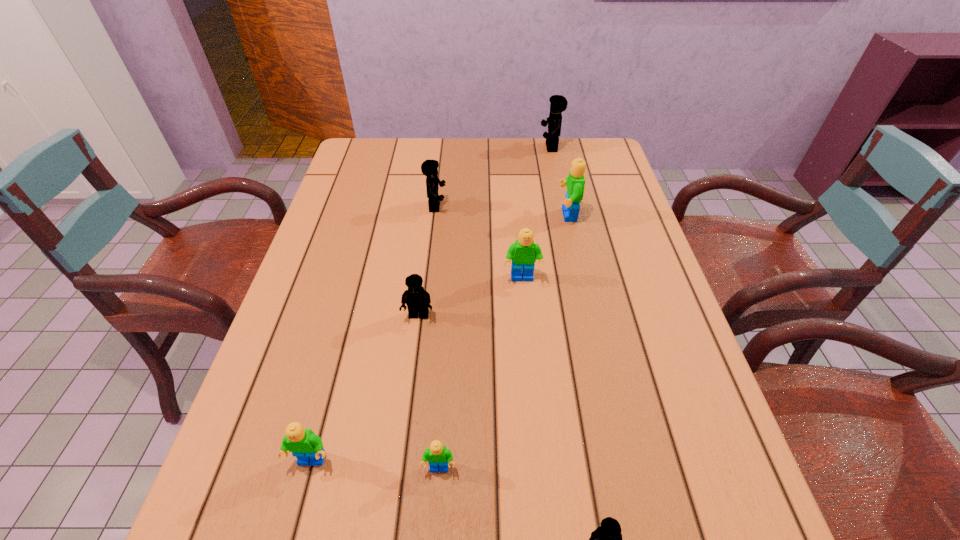
I want to click on blank space at the near left corner of the desktop, so click(x=243, y=521).

The width and height of the screenshot is (960, 540). Find the location of `vacant space at the far right corner of the desktop`. vacant space at the far right corner of the desktop is located at coordinates (614, 163).

This screenshot has width=960, height=540. I want to click on free spot between the biggest yellow Lego and the fifth farthest object, so click(485, 231).

The height and width of the screenshot is (540, 960). Find the location of `vacant area that lies between the rightmost green Lego and the leftmost object`. vacant area that lies between the rightmost green Lego and the leftmost object is located at coordinates coord(440,338).

The height and width of the screenshot is (540, 960). In order to click on free spot between the smallest green Lego and the third biggest yellow Lego in this screenshot , I will do `click(429, 392)`.

In order to click on free space between the smallest green Lego and the leftmost Lego in this screenshot , I will do `click(375, 465)`.

Identify the location of vacant space in between the third nearest green Lego and the fifth farthest Lego. (470, 297).

Locate an element on the screen. unoccupied area between the third nearest yellow Lego and the fifth farthest Lego is located at coordinates [x=427, y=261].

I want to click on blank region between the second green Lego from right to left and the third green Lego from right to left, so click(481, 374).

This screenshot has width=960, height=540. What are the coordinates of `free area in between the leftmost Lego and the third green Lego from right to left` in the screenshot? It's located at (375, 465).